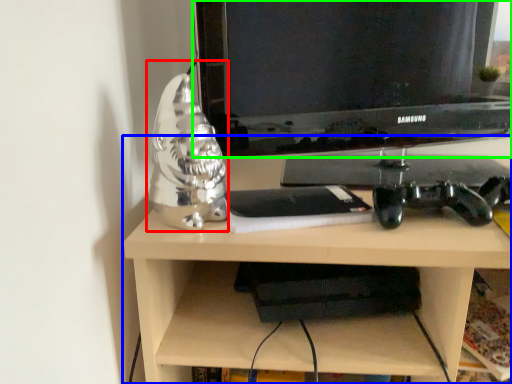
Question: Which object is the closest to the figurine (highlighted by a red box)? Choose among these: desk (highlighted by a blue box) or television (highlighted by a green box).

Choices:
 (A) desk
 (B) television

Answer: (A)